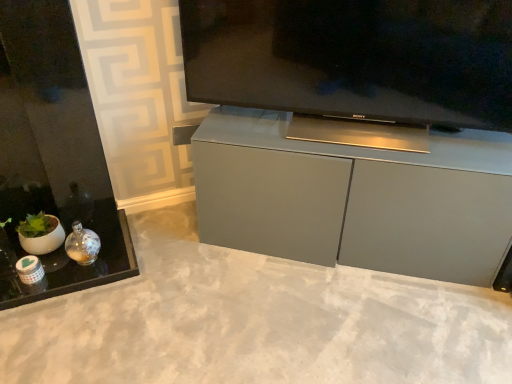
Identify the location of space that is in front of matte gray cabinet at center. Image resolution: width=512 pixels, height=384 pixels. (349, 320).